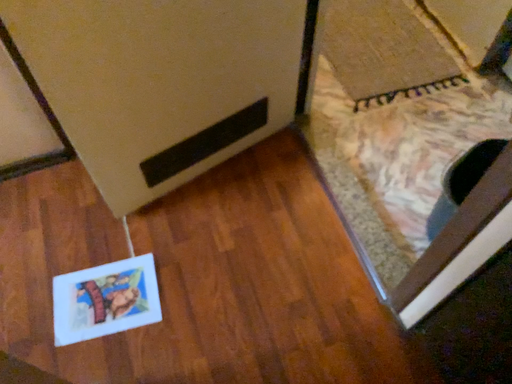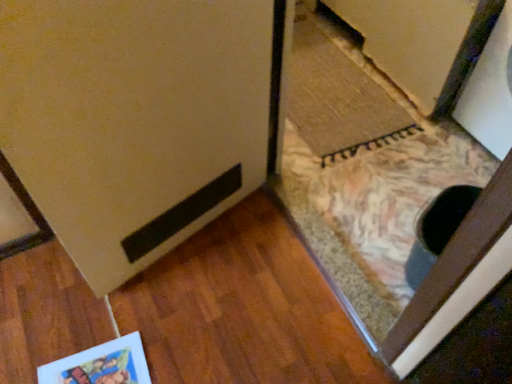
Question: How did the camera likely rotate when shooting the video?

Choices:
 (A) rotated upward
 (B) rotated downward

Answer: (A)